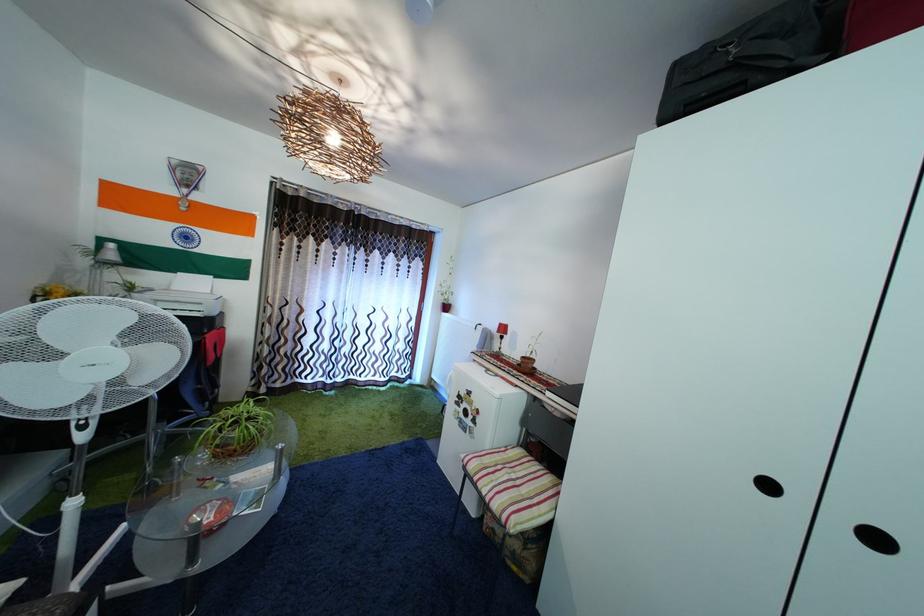
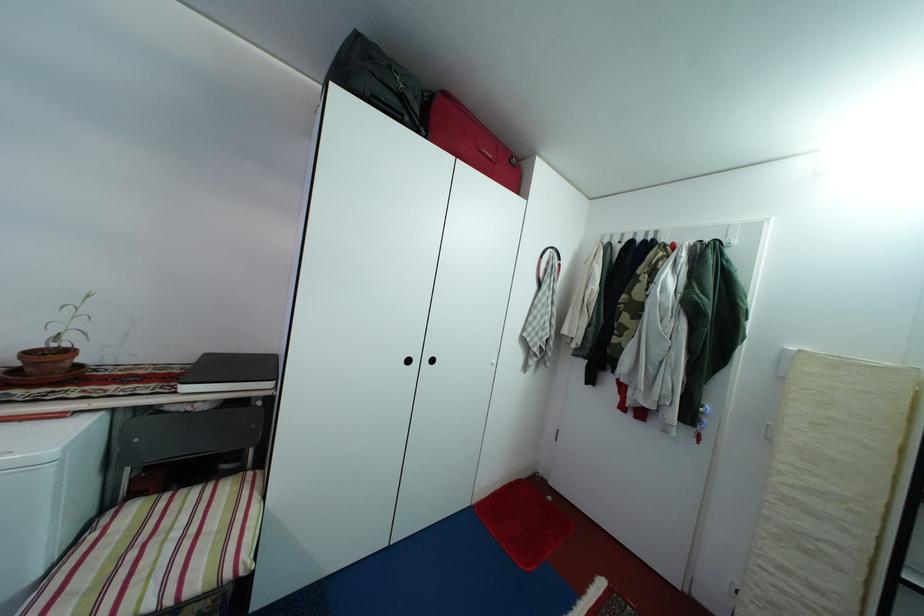
In the second image, find the point that corresponds to [752,90] in the first image.

(410, 123)